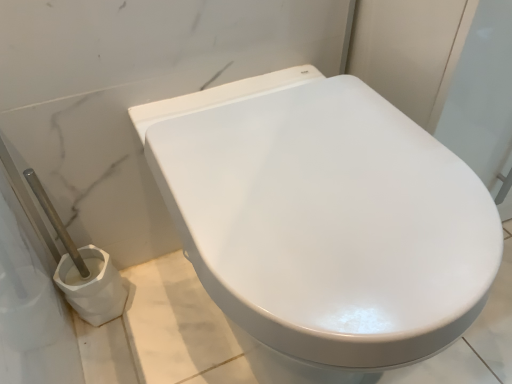
The width and height of the screenshot is (512, 384). I want to click on white glossy toilet at center, so click(322, 217).

This screenshot has height=384, width=512. What do you see at coordinates (322, 217) in the screenshot?
I see `white glossy toilet at center` at bounding box center [322, 217].

Where is `white glossy toilet at center`? white glossy toilet at center is located at coordinates (322, 217).